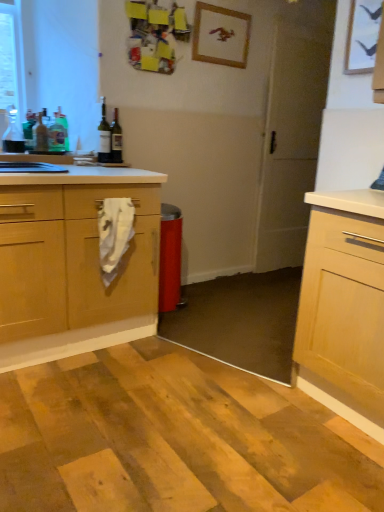
The height and width of the screenshot is (512, 384). What do you see at coordinates (12, 134) in the screenshot?
I see `clear glass bottle at left, the 1th bottle from the left` at bounding box center [12, 134].

What are the coordinates of `green glass bottle at upper left, the 4th bottle positioned from the right` in the screenshot? It's located at (63, 126).

What do you see at coordinates (63, 126) in the screenshot? The image size is (384, 512). I see `green glass bottle at upper left, the 3th bottle positioned from the left` at bounding box center [63, 126].

At what (x,y) coordinates should I click in order to perform the action: click on wooden picture frame at upper center. Please return your answer as a coordinate pair (x, y). This screenshot has height=512, width=384. Looking at the image, I should click on (220, 36).

The width and height of the screenshot is (384, 512). Describe the element at coordinates (57, 134) in the screenshot. I see `green glass bottle at left, the fourth bottle viewed from the left` at that location.

The image size is (384, 512). Describe the element at coordinates (40, 136) in the screenshot. I see `translucent glass bottle at left, marked as the 2th bottle in a left-to-right arrangement` at that location.

The height and width of the screenshot is (512, 384). I want to click on white matte screen door at center, so click(291, 139).

I want to click on green glass bottle at upper left, the 1th bottle viewed from the right, so click(x=116, y=139).

Which of these two, matte glass bottle at upper left, marked as the 5th bottle in a left-to-right arrangement, or green glass bottle at upper left, the 4th bottle positioned from the right, stands taller?

Standing taller between the two is matte glass bottle at upper left, marked as the 5th bottle in a left-to-right arrangement.

Which is more to the right, matte glass bottle at upper left, marked as the 5th bottle in a left-to-right arrangement, or green glass bottle at upper left, the 4th bottle positioned from the right?

Positioned to the right is matte glass bottle at upper left, marked as the 5th bottle in a left-to-right arrangement.

From a real-world perspective, is matte glass bottle at upper left, marked as the 5th bottle in a left-to-right arrangement, positioned above or below green glass bottle at upper left, the 3th bottle positioned from the left?

In terms of real-world spatial position, matte glass bottle at upper left, marked as the 5th bottle in a left-to-right arrangement, is above green glass bottle at upper left, the 3th bottle positioned from the left.

Between matte glass bottle at upper left, the 2th bottle viewed from the right, and green glass bottle at upper left, the 4th bottle positioned from the right, which one is positioned behind?

green glass bottle at upper left, the 4th bottle positioned from the right, is further away from the camera.

Is clear glass bottle at left, arranged as the 6th bottle when viewed from the right, at the back of wooden picture frame at upper center?

wooden picture frame at upper center is not turned away from clear glass bottle at left, arranged as the 6th bottle when viewed from the right.

From the image's perspective, is wooden picture frame at upper center located beneath clear glass bottle at left, the 1th bottle from the left?

No.

Based on the photo, is wooden picture frame at upper center positioned in front of clear glass bottle at left, the 1th bottle from the left?

No, wooden picture frame at upper center is further to the viewer.

Is point (201, 5) positioned before point (4, 139)?

No.

How distant is wooden picture frame at upper center from green glass bottle at upper left, the 4th bottle positioned from the right?

3.76 feet.

Does wooden picture frame at upper center turn towards green glass bottle at upper left, the 3th bottle positioned from the left?

No, wooden picture frame at upper center does not turn towards green glass bottle at upper left, the 3th bottle positioned from the left.

From the image's perspective, does wooden picture frame at upper center appear lower than green glass bottle at upper left, the 4th bottle positioned from the right?

No, from the image's perspective, wooden picture frame at upper center is not below green glass bottle at upper left, the 4th bottle positioned from the right.

Which is behind, point (60, 145) or point (105, 151)?

The point (105, 151) is more distant.

From the picture: Is green glass bottle at left, the fourth bottle viewed from the left, not near matte glass bottle at upper left, marked as the 5th bottle in a left-to-right arrangement?

green glass bottle at left, the fourth bottle viewed from the left, is actually quite close to matte glass bottle at upper left, marked as the 5th bottle in a left-to-right arrangement.

Is green glass bottle at left, the fourth bottle viewed from the left, at the left side of matte glass bottle at upper left, marked as the 5th bottle in a left-to-right arrangement?

Correct, you'll find green glass bottle at left, the fourth bottle viewed from the left, to the left of matte glass bottle at upper left, marked as the 5th bottle in a left-to-right arrangement.

Based on the photo, is green glass bottle at left, the fourth bottle viewed from the left, not inside matte glass bottle at upper left, the 2th bottle viewed from the right?

That's correct, green glass bottle at left, the fourth bottle viewed from the left, is outside of matte glass bottle at upper left, the 2th bottle viewed from the right.

From a real-world perspective, is green glass bottle at upper left, the 3th bottle positioned from the left, below translucent glass bottle at left, marked as the 2th bottle in a left-to-right arrangement?

No.

Based on the photo, is translucent glass bottle at left, arranged as the 5th bottle when viewed from the right, surrounded by green glass bottle at upper left, the 3th bottle positioned from the left?

No, translucent glass bottle at left, arranged as the 5th bottle when viewed from the right, is not a part of green glass bottle at upper left, the 3th bottle positioned from the left.

Is green glass bottle at upper left, the 3th bottle positioned from the left, positioned behind translucent glass bottle at left, arranged as the 5th bottle when viewed from the right?

Yes, the depth of green glass bottle at upper left, the 3th bottle positioned from the left, is greater than that of translucent glass bottle at left, arranged as the 5th bottle when viewed from the right.

From the image's perspective, is green glass bottle at upper left, the 4th bottle positioned from the right, below translucent glass bottle at left, arranged as the 5th bottle when viewed from the right?

No, from the image's perspective, green glass bottle at upper left, the 4th bottle positioned from the right, is not below translucent glass bottle at left, arranged as the 5th bottle when viewed from the right.

Could you tell me if clear glass bottle at left, arranged as the 6th bottle when viewed from the right, is turned towards green glass bottle at upper left, which ranks as the sixth bottle in left-to-right order?

No, clear glass bottle at left, arranged as the 6th bottle when viewed from the right, is not turned towards green glass bottle at upper left, which ranks as the sixth bottle in left-to-right order.

At what (x,y) coordinates should I click in order to perform the action: click on the 4th bottle behind the clear glass bottle at left, the 1th bottle from the left, starting your count from the anchor. Please return your answer as a coordinate pair (x, y). Looking at the image, I should click on (116, 139).

Would you say clear glass bottle at left, the 1th bottle from the left, is to the left or to the right of green glass bottle at upper left, which ranks as the sixth bottle in left-to-right order, in the picture?

clear glass bottle at left, the 1th bottle from the left, is positioned on green glass bottle at upper left, which ranks as the sixth bottle in left-to-right order,'s left side.

Can you confirm if clear glass bottle at left, arranged as the 6th bottle when viewed from the right, is taller than green glass bottle at upper left, which ranks as the sixth bottle in left-to-right order?

Incorrect, the height of clear glass bottle at left, arranged as the 6th bottle when viewed from the right, is not larger of that of green glass bottle at upper left, which ranks as the sixth bottle in left-to-right order.

From a real-world perspective, which object stands above the other?

translucent glass bottle at left, marked as the 2th bottle in a left-to-right arrangement, is physically above.

From the image's perspective, which is above, white matte screen door at center or translucent glass bottle at left, arranged as the 5th bottle when viewed from the right?

white matte screen door at center, from the image's perspective.

Is white matte screen door at center completely or partially outside of translucent glass bottle at left, arranged as the 5th bottle when viewed from the right?

Yes, white matte screen door at center is outside of translucent glass bottle at left, arranged as the 5th bottle when viewed from the right.

Locate an element on the screen. the 5th bottle in front of the white matte screen door at center is located at coordinates (40, 136).

Locate an element on the screen. the 3rd bottle in front when counting from the green glass bottle at upper left, the 4th bottle positioned from the right is located at coordinates (104, 137).

The width and height of the screenshot is (384, 512). I want to click on bottle that is the 6th one when counting leftward from the wooden picture frame at upper center, so [x=12, y=134].

Based on their spatial positions, is white fabric towel at center or green glass bottle at upper left, the 3th bottle positioned from the left, closer to green glass bottle at left, the fourth bottle viewed from the left?

Based on the image, green glass bottle at upper left, the 3th bottle positioned from the left, appears to be nearer to green glass bottle at left, the fourth bottle viewed from the left.

Considering their positions, is green glass bottle at upper left, the 3th bottle positioned from the left, positioned further to green glass bottle at upper left, the 1th bottle viewed from the right, than green glass bottle at left, the fourth bottle viewed from the left?

green glass bottle at upper left, the 3th bottle positioned from the left, is further to green glass bottle at upper left, the 1th bottle viewed from the right.

From the image, which object appears to be farther from translucent glass bottle at left, marked as the 2th bottle in a left-to-right arrangement, green glass bottle at upper left, the 1th bottle viewed from the right, or clear glass bottle at left, arranged as the 6th bottle when viewed from the right?

The object further to translucent glass bottle at left, marked as the 2th bottle in a left-to-right arrangement, is green glass bottle at upper left, the 1th bottle viewed from the right.

Considering their positions, is wooden picture frame at upper center positioned closer to green glass bottle at left, the fourth bottle viewed from the left, than green glass bottle at upper left, the 1th bottle viewed from the right?

The object closer to green glass bottle at left, the fourth bottle viewed from the left, is green glass bottle at upper left, the 1th bottle viewed from the right.

Considering their positions, is white matte screen door at center positioned further to translucent glass bottle at left, marked as the 2th bottle in a left-to-right arrangement, than green glass bottle at upper left, which ranks as the sixth bottle in left-to-right order?

white matte screen door at center is further to translucent glass bottle at left, marked as the 2th bottle in a left-to-right arrangement.

Consider the image. Based on their spatial positions, is wooden picture frame at upper center or green glass bottle at upper left, which ranks as the sixth bottle in left-to-right order, further from white matte screen door at center?

green glass bottle at upper left, which ranks as the sixth bottle in left-to-right order.

From the image, which object appears to be farther from wooden picture frame at upper center, white fabric towel at center or clear glass bottle at left, arranged as the 6th bottle when viewed from the right?

white fabric towel at center.

When comparing their distances from white matte screen door at center, does clear glass bottle at left, arranged as the 6th bottle when viewed from the right, or green glass bottle at left, the fourth bottle viewed from the left, seem closer?

green glass bottle at left, the fourth bottle viewed from the left, is closer to white matte screen door at center.

Find the location of a particular element. The height and width of the screenshot is (512, 384). material situated between green glass bottle at upper left, which ranks as the sixth bottle in left-to-right order, and white matte screen door at center from left to right is located at coordinates (114, 234).

You are a GUI agent. You are given a task and a screenshot of the screen. Output one action in this format:
    pyautogui.click(x=<x>, y=<y>)
    Task: Click on the bottle between green glass bottle at upper left, the 4th bottle positioned from the right, and matte glass bottle at upper left, the 2th bottle viewed from the right
    
    Given the screenshot: What is the action you would take?
    pyautogui.click(x=57, y=134)

Where is `bottle between matte glass bottle at upper left, marked as the 5th bottle in a left-to-right arrangement, and white matte screen door at center from left to right`? The width and height of the screenshot is (384, 512). bottle between matte glass bottle at upper left, marked as the 5th bottle in a left-to-right arrangement, and white matte screen door at center from left to right is located at coordinates (116, 139).

Locate an element on the screen. bottle between green glass bottle at left, the fourth bottle viewed from the left, and green glass bottle at upper left, which ranks as the sixth bottle in left-to-right order, in the horizontal direction is located at coordinates point(104,137).